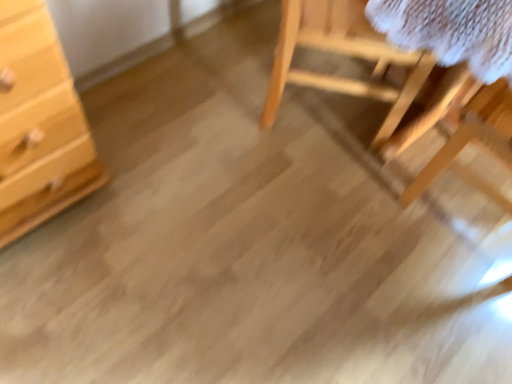
Question: Is light wood chest of drawers at left in front of wooden table at right?

Choices:
 (A) yes
 (B) no

Answer: (A)

Question: Considering the relative sizes of light wood chest of drawers at left and wooden table at right in the image provided, is light wood chest of drawers at left shorter than wooden table at right?

Choices:
 (A) yes
 (B) no

Answer: (B)

Question: Considering the relative positions of light wood chest of drawers at left and wooden table at right in the image provided, is light wood chest of drawers at left to the left of wooden table at right from the viewer's perspective?

Choices:
 (A) yes
 (B) no

Answer: (A)

Question: Is light wood chest of drawers at left oriented away from wooden table at right?

Choices:
 (A) yes
 (B) no

Answer: (B)

Question: Is light wood chest of drawers at left surrounding wooden table at right?

Choices:
 (A) yes
 (B) no

Answer: (B)

Question: Does light wood chest of drawers at left have a greater width compared to wooden table at right?

Choices:
 (A) no
 (B) yes

Answer: (A)

Question: Considering the relative positions of light wood chest of drawers at left and natural wood chair at upper right in the image provided, is light wood chest of drawers at left to the right of natural wood chair at upper right from the viewer's perspective?

Choices:
 (A) no
 (B) yes

Answer: (A)

Question: Does light wood chest of drawers at left lie behind natural wood chair at upper right?

Choices:
 (A) no
 (B) yes

Answer: (A)

Question: Is light wood chest of drawers at left at the left side of natural wood chair at upper right?

Choices:
 (A) yes
 (B) no

Answer: (A)

Question: Would you say natural wood chair at upper right is part of light wood chest of drawers at left's contents?

Choices:
 (A) no
 (B) yes

Answer: (A)

Question: Does light wood chest of drawers at left have a lesser width compared to natural wood chair at upper right?

Choices:
 (A) yes
 (B) no

Answer: (A)

Question: From the image's perspective, does light wood chest of drawers at left appear lower than natural wood chair at upper right?

Choices:
 (A) yes
 (B) no

Answer: (A)

Question: Does wooden table at right lie behind light wood chest of drawers at left?

Choices:
 (A) no
 (B) yes

Answer: (B)